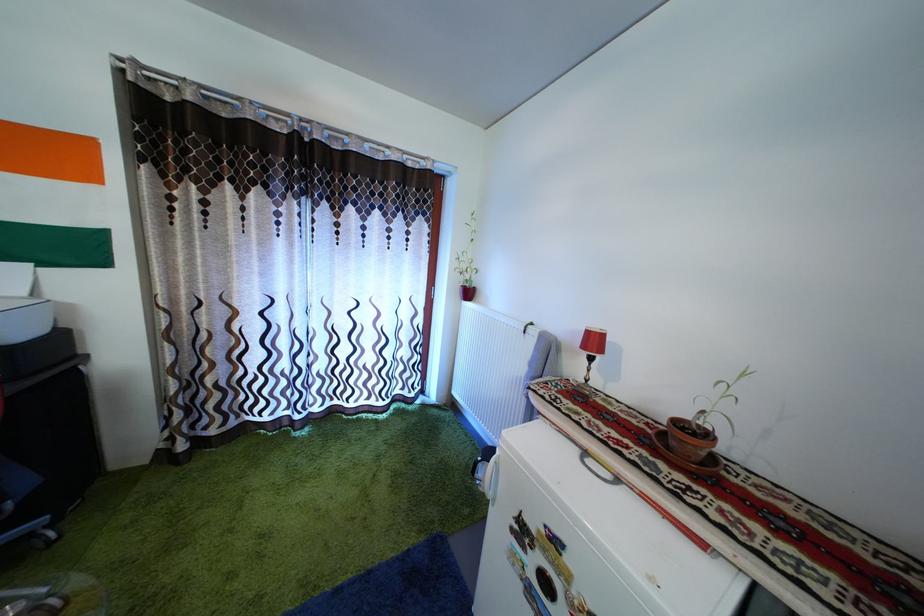
Find the location of a particular element. The image size is (924, 616). small red lamp is located at coordinates (591, 347).